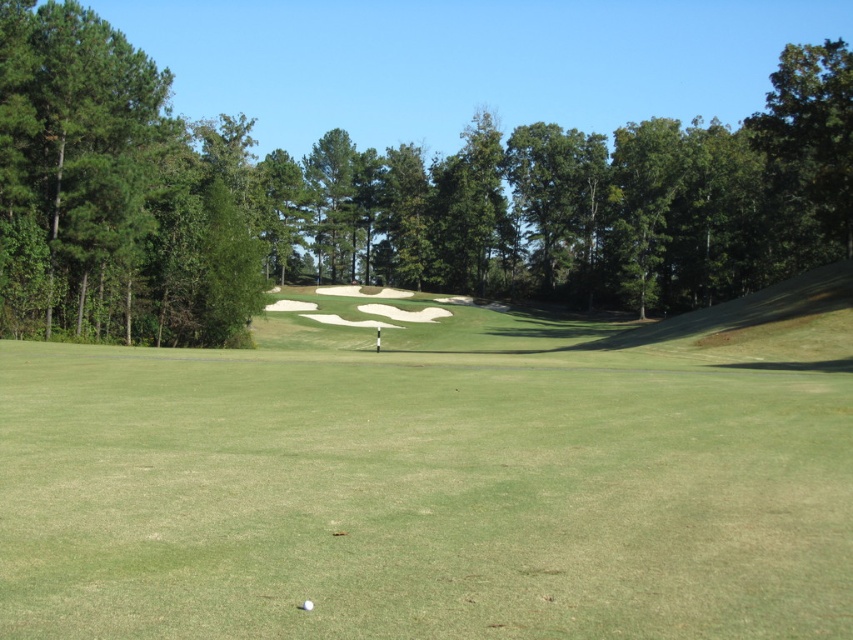
At what (x,y) coordinates should I click in order to perform the action: click on green leafy tree at center. Please return your answer as a coordinate pair (x, y). Looking at the image, I should click on (386, 198).

Who is more forward, (780, 275) or (306, 602)?

Positioned in front is point (306, 602).

Is point (55, 161) behind point (308, 605)?

Yes, it is.

This screenshot has height=640, width=853. Identify the location of green leafy tree at center. (386, 198).

Between green grassy field at center and white matte golf ball at center, which one appears on the left side from the viewer's perspective?

white matte golf ball at center is more to the left.

In the scene shown: Does green grassy field at center have a lesser height compared to white matte golf ball at center?

No, green grassy field at center is not shorter than white matte golf ball at center.

Where is `green grassy field at center`? The image size is (853, 640). green grassy field at center is located at coordinates (440, 477).

Can you confirm if green grassy field at center is wider than green leafy tree at center?

In fact, green grassy field at center might be narrower than green leafy tree at center.

Can you confirm if green grassy field at center is positioned above green leafy tree at center?

Incorrect, green grassy field at center is not positioned above green leafy tree at center.

Where is `green grassy field at center`? This screenshot has width=853, height=640. green grassy field at center is located at coordinates (440, 477).

Where is `green grassy field at center`? The image size is (853, 640). green grassy field at center is located at coordinates (440, 477).